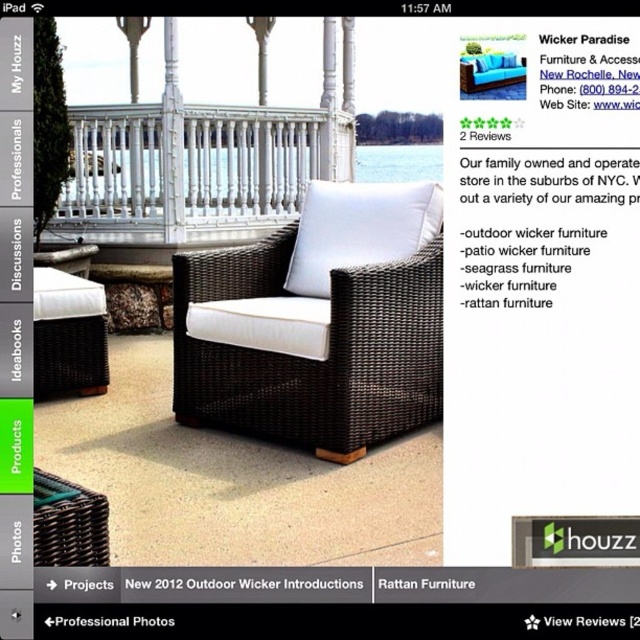
Which of these two, brown wicker armchair at center or rattan furniture at center, stands taller?

With more height is brown wicker armchair at center.

How far apart are brown wicker armchair at center and rattan furniture at center?

brown wicker armchair at center is 1.71 meters from rattan furniture at center.

Between point (340, 342) and point (442, 580), which one is positioned behind?

The point (340, 342) is more distant.

You are a GUI agent. You are given a task and a screenshot of the screen. Output one action in this format:
    pyautogui.click(x=<x>, y=<y>)
    Task: Click on the brown wicker armchair at center
    The height and width of the screenshot is (640, 640).
    Given the screenshot: What is the action you would take?
    pyautogui.click(x=317, y=323)

Which of these two, matte wicker chair at center or rattan furniture at center, stands taller?

rattan furniture at center is taller.

From the picture: Can you confirm if matte wicker chair at center is wider than rattan furniture at center?

Indeed, matte wicker chair at center has a greater width compared to rattan furniture at center.

The width and height of the screenshot is (640, 640). What do you see at coordinates (106, 620) in the screenshot?
I see `matte wicker chair at center` at bounding box center [106, 620].

Where is `matte wicker chair at center`? matte wicker chair at center is located at coordinates (106, 620).

Can you confirm if brown wicker armchair at center is positioned to the left of white matte pillow at center?

Indeed, brown wicker armchair at center is positioned on the left side of white matte pillow at center.

Which is below, brown wicker armchair at center or white matte pillow at center?

Positioned lower is brown wicker armchair at center.

Which is behind, point (401, 218) or point (337, 260)?

The point (337, 260) is more distant.

I want to click on brown wicker armchair at center, so click(x=317, y=323).